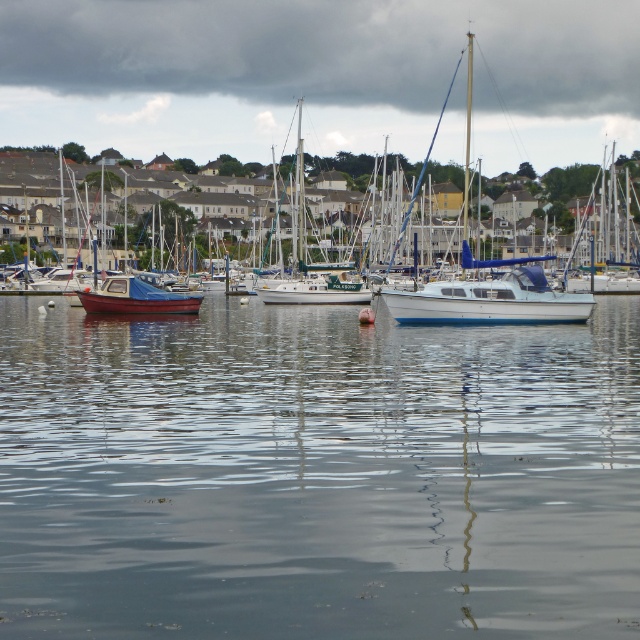
Question: Does white glossy boat at center have a smaller size compared to matte blue sailboat at left?

Choices:
 (A) no
 (B) yes

Answer: (B)

Question: From the image, what is the correct spatial relationship of white glossy sailboat at center in relation to matte blue sailboat at left?

Choices:
 (A) above
 (B) below

Answer: (A)

Question: Which object is farther from the camera taking this photo?

Choices:
 (A) white glossy boat at center
 (B) clear water at center
 (C) matte blue sailboat at left

Answer: (C)

Question: Among these objects, which one is nearest to the camera?

Choices:
 (A) matte blue sailboat at left
 (B) clear water at center

Answer: (B)

Question: Which point appears closest to the camera in this image?

Choices:
 (A) (417, 305)
 (B) (180, 310)
 (C) (83, 531)
 (D) (461, 268)

Answer: (C)

Question: Is clear water at center to the right of white glossy sailboat at center from the viewer's perspective?

Choices:
 (A) yes
 (B) no

Answer: (B)